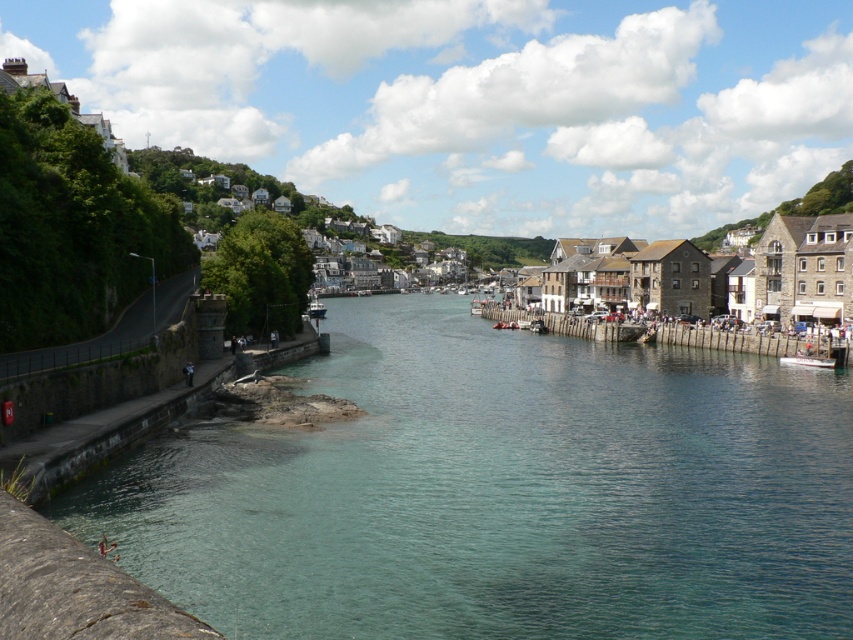
You are a photographer trying to capture a wide shot of the white glossy boat at center and the clear water at lower left. Your camera has a maximum focus range of 20 meters. Will you be able to capture both objects in focus without moving closer?

The clear water at lower left is 23.46 meters from the white glossy boat at center. Since the maximum focus range is 20 meters, the distance between them exceeds this limit, so you cannot capture both in focus without moving closer.

You are standing at the stone embankment on the left side of the riverside scene. You want to find the clear water at lower left. According to the coordinates given, where should you look relative to your position?

You should look towards the lower left direction from your current position at the stone embankment, as the clear water at lower left is located at coordinates point (502, 492) which is in the lower left area of the scene.